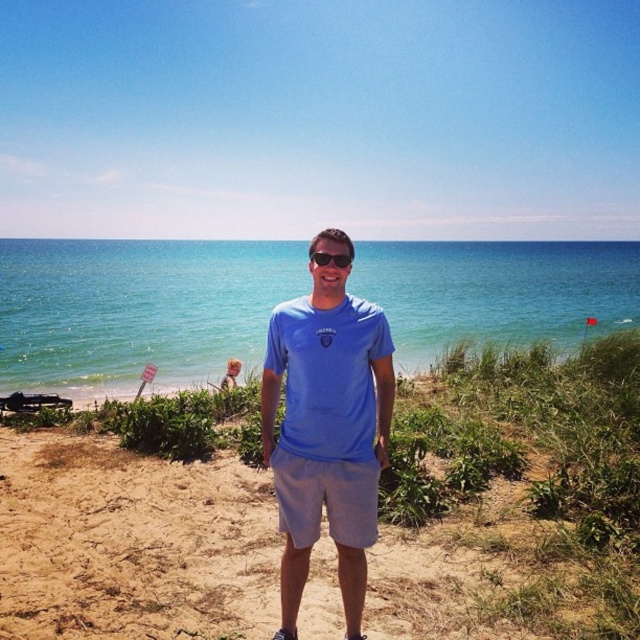
Question: Is light brown sand at center thinner than blue water at center?

Choices:
 (A) no
 (B) yes

Answer: (B)

Question: Is blue water at center positioned behind sunglasses at center?

Choices:
 (A) no
 (B) yes

Answer: (B)

Question: Is blue fabric shirt at center above sunglasses at center?

Choices:
 (A) yes
 (B) no

Answer: (B)

Question: Which point is closer to the camera?

Choices:
 (A) light brown sand at center
 (B) sunglasses at center
 (C) blue water at center

Answer: (B)

Question: Which point appears closest to the camera in this image?

Choices:
 (A) (365, 387)
 (B) (240, 531)
 (C) (228, 342)
 (D) (317, 259)

Answer: (D)

Question: Based on their relative distances, which object is farther from the light brown sand at center?

Choices:
 (A) sunglasses at center
 (B) blue fabric shirt at center
 (C) blue water at center

Answer: (C)